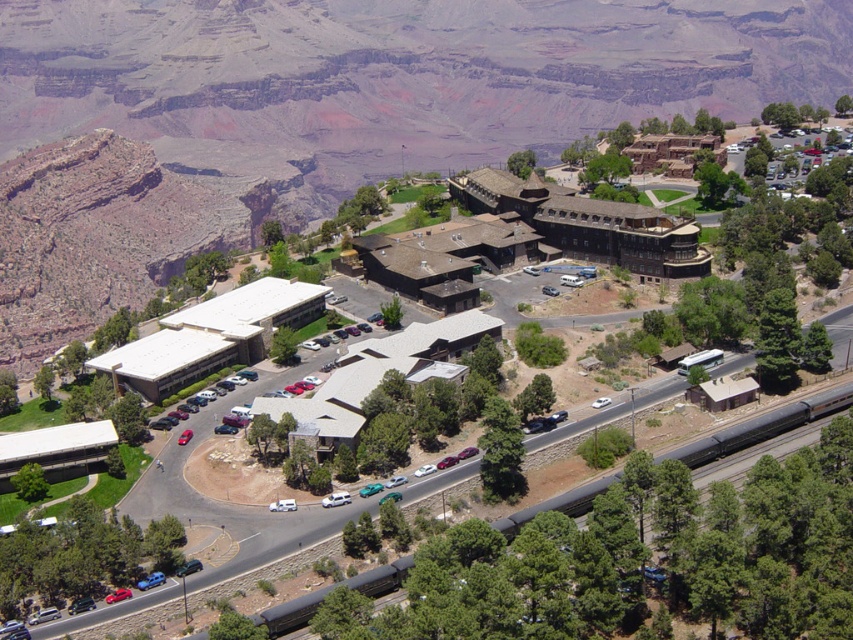
Question: Where is dark gray metallic train track at lower center located in relation to blue matte car at lower left in the image?

Choices:
 (A) left
 (B) right

Answer: (B)

Question: Which object is closer to the camera taking this photo?

Choices:
 (A) white glossy sedan at center-right
 (B) shiny red car at lower left
 (C) brown stone building at center

Answer: (B)

Question: Can you confirm if shiny red car at lower left is wider than white glossy sedan at center-right?

Choices:
 (A) yes
 (B) no

Answer: (B)

Question: Estimate the real-world distances between objects in this image. Which object is farther from the shiny red car at lower left?

Choices:
 (A) brown stone building at center
 (B) blue matte car at lower left
 (C) white glossy sedan at center-right

Answer: (A)

Question: Which object appears closest to the camera in this image?

Choices:
 (A) metallic silver van at center
 (B) white glossy sedan at center-right

Answer: (A)

Question: Does blue matte car at lower left have a larger size compared to shiny red car at lower left?

Choices:
 (A) no
 (B) yes

Answer: (B)